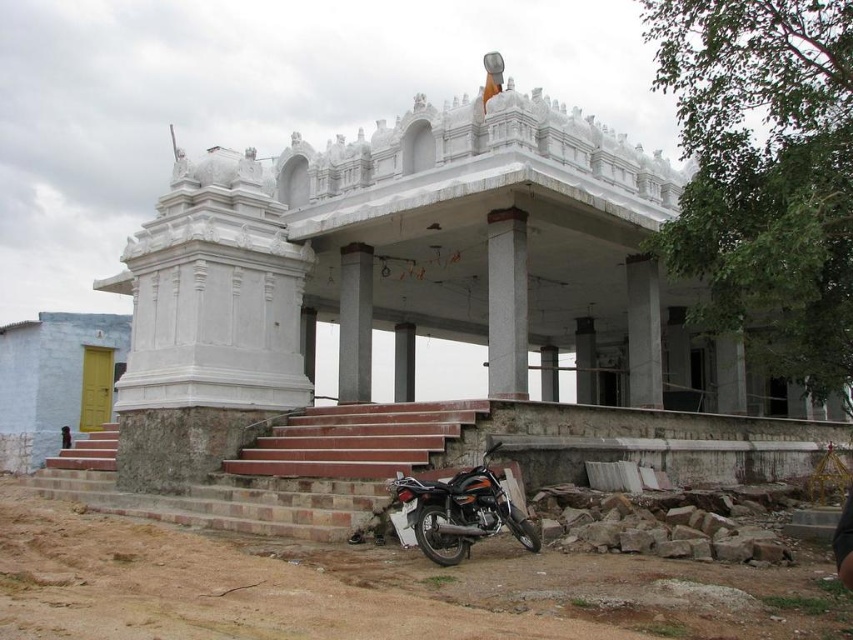
You are standing at the entrance of the temple and want to take a photo of the smooth concrete column at center. Where should you position yourself to capture it in the frame?

The smooth concrete column at center is located at point (508, 304), so you should position yourself at the entrance facing towards the coordinates (508, 304) to capture it in the frame.

From the picture: You are a visitor standing at the base of the temple steps. You want to take a photo of the temple structure. To get a better angle, you need to move either the brick stairs at lower center or the smooth concrete pillar at center. Which object should you move to avoid blocking the view?

The brick stairs at lower center has a larger size compared to the smooth concrete pillar at center, so moving the brick stairs at lower center would be more effective in unblocking the view since it is the bigger obstruction.